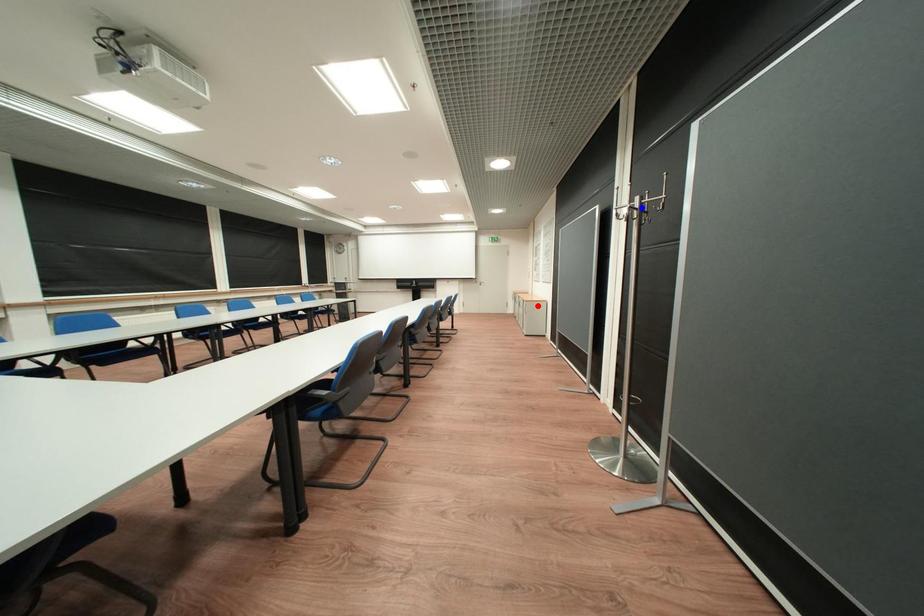
Question: In the image, two points are highlighted. Which point is nearer to the camera? Reply with the corresponding letter.

Choices:
 (A) blue point
 (B) red point

Answer: (A)